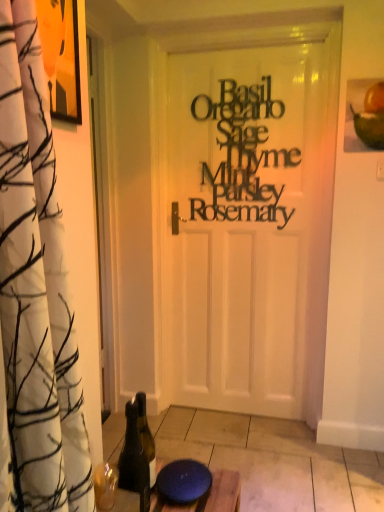
At what (x,y) coordinates should I click in order to perform the action: click on vacant space underneath black paper sign at center (from a real-world perspective). Please return your answer as a coordinate pair (x, y). This screenshot has height=512, width=384. Looking at the image, I should click on (239, 409).